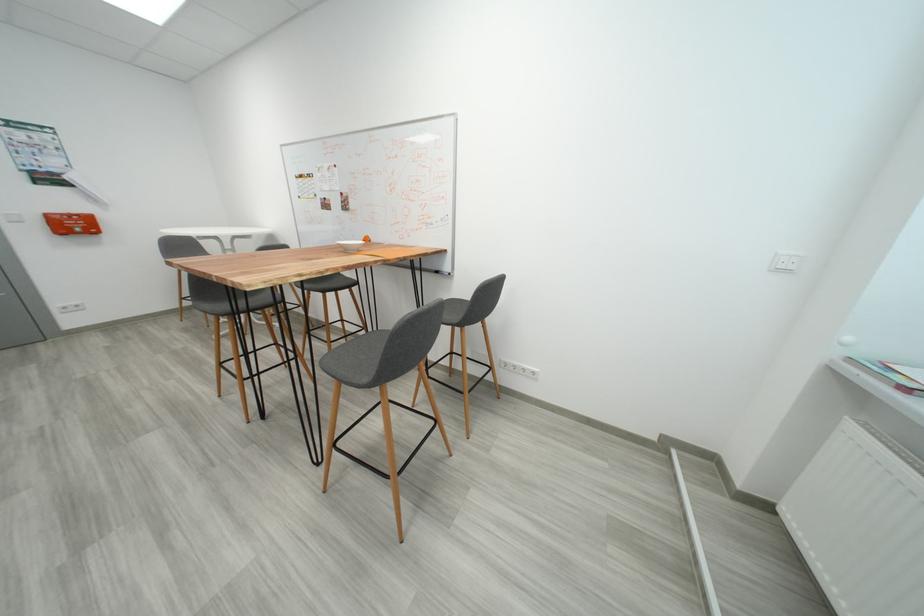
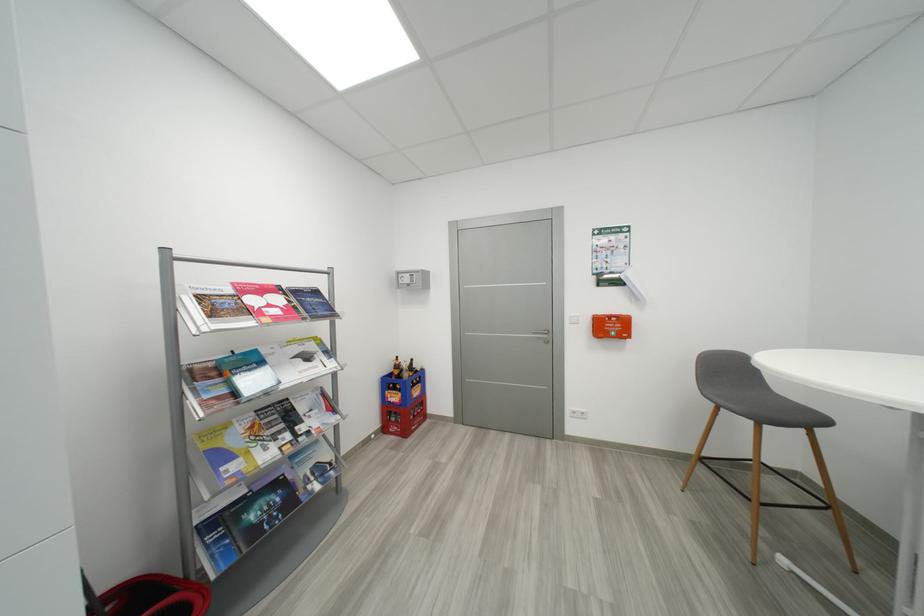
Where in the second image is the point corresponding to point (82, 228) from the first image?

(617, 330)